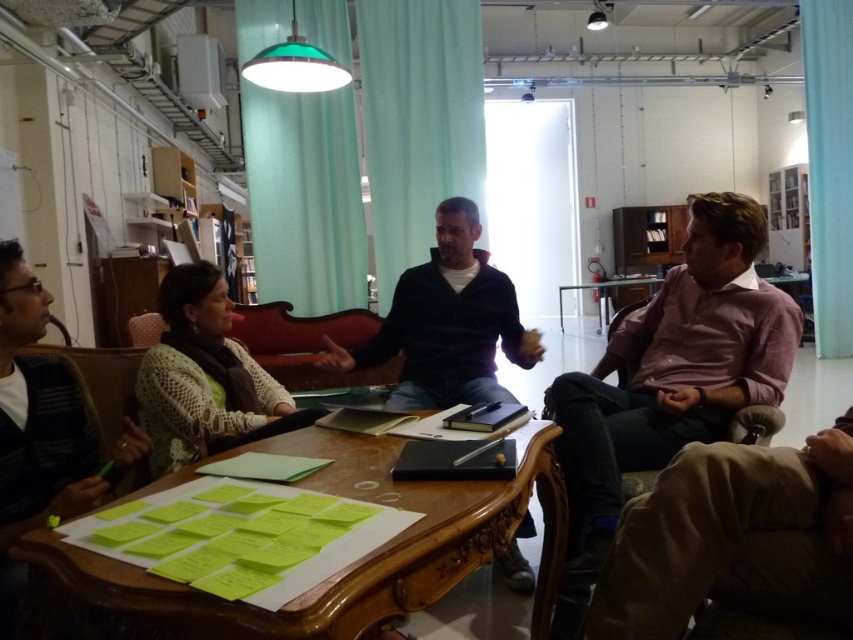
You are standing in the workspace and want to determine the relative positions of two points on the table. Which point is closer to you, point (259,92) or point (457,369)?

Point (259,92) is closer to you because it is further to the viewer than point (457,369).

You are standing at the point labeled point (299, 224) in the image. You want to walk to the door that is 5 meters away from your current position. Is the door within your walking distance?

The point labeled point (299, 224) is 4.73 meters away from the viewer. Since the door is 5 meters away from the point, the total distance from the viewer to the door would be 4.73 meters plus 5 meters, totaling 9.73 meters. Therefore, the door is beyond your walking distance.

You are a delivery person who needs to place a 12 feet long package between the dark blue sweater at center and the teal fabric curtain at upper right. Can the package fit between them without bending?

The dark blue sweater at center and teal fabric curtain at upper right are 14.16 feet apart, so the 12 feet long package can fit between them without bending.